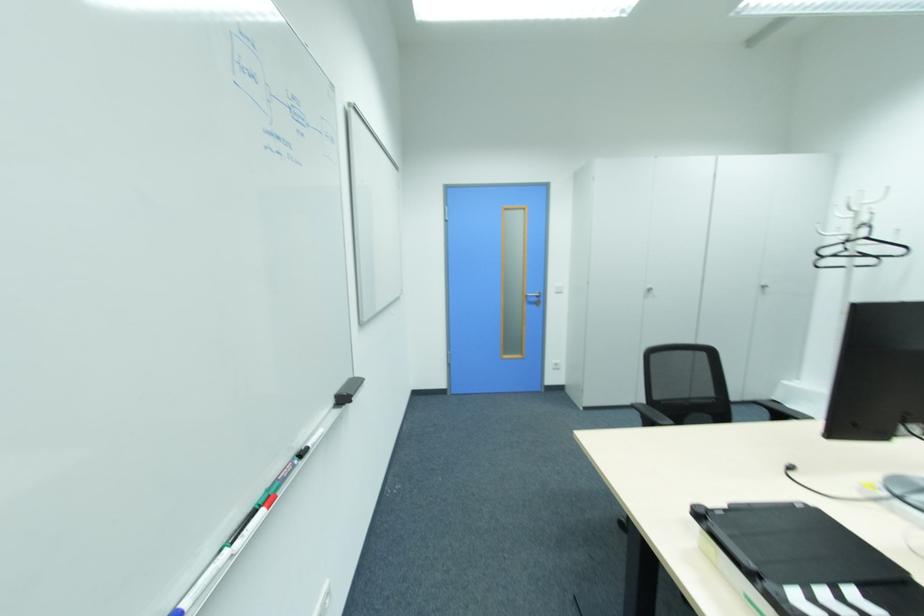
Where would you lift the black laptop stand? Please return your answer as a coordinate pair (x, y).

(803, 562)